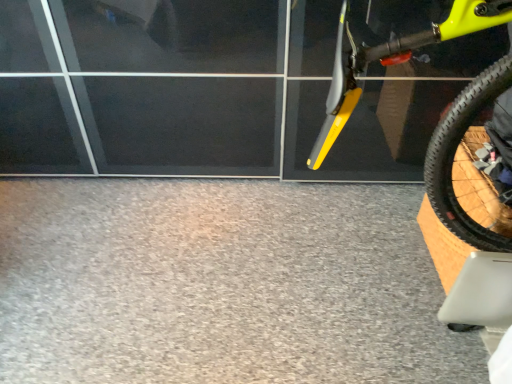
I want to click on yellow matte bicycle at right, so click(393, 59).

The image size is (512, 384). Describe the element at coordinates (393, 59) in the screenshot. I see `yellow matte bicycle at right` at that location.

What are the coordinates of `gray carpet at lower center` in the screenshot? It's located at (221, 285).

What do you see at coordinates (221, 285) in the screenshot? I see `gray carpet at lower center` at bounding box center [221, 285].

I want to click on yellow matte bicycle at right, so click(393, 59).

Considering the relative positions of yellow matte bicycle at right and gray carpet at lower center in the image provided, is yellow matte bicycle at right to the left or to the right of gray carpet at lower center?

yellow matte bicycle at right is positioned on gray carpet at lower center's right side.

Between yellow matte bicycle at right and gray carpet at lower center, which one is positioned behind?

gray carpet at lower center is further away from the camera.

Is point (311, 166) farther from viewer compared to point (98, 236)?

No, it is in front of (98, 236).

From the image's perspective, is yellow matte bicycle at right on gray carpet at lower center?

Correct, yellow matte bicycle at right appears higher than gray carpet at lower center in the image.

From a real-world perspective, is yellow matte bicycle at right positioned over gray carpet at lower center based on gravity?

Yes, from a real-world perspective, yellow matte bicycle at right is above gray carpet at lower center.

Does yellow matte bicycle at right have a greater width compared to gray carpet at lower center?

In fact, yellow matte bicycle at right might be narrower than gray carpet at lower center.

Can you confirm if yellow matte bicycle at right is taller than gray carpet at lower center?

Yes, yellow matte bicycle at right is taller than gray carpet at lower center.

Does yellow matte bicycle at right have a smaller size compared to gray carpet at lower center?

Incorrect, yellow matte bicycle at right is not smaller in size than gray carpet at lower center.

Would you say yellow matte bicycle at right is outside gray carpet at lower center?

Indeed, yellow matte bicycle at right is completely outside gray carpet at lower center.

Is yellow matte bicycle at right far from gray carpet at lower center?

yellow matte bicycle at right is near gray carpet at lower center, not far away.

Does yellow matte bicycle at right turn towards gray carpet at lower center?

No, yellow matte bicycle at right is not turned towards gray carpet at lower center.

Can you tell me how much yellow matte bicycle at right and gray carpet at lower center differ in facing direction?

1.89 degrees.

How far apart are yellow matte bicycle at right and gray carpet at lower center?

yellow matte bicycle at right and gray carpet at lower center are 87.08 centimeters apart.

The width and height of the screenshot is (512, 384). Identify the location of concrete beneath the yellow matte bicycle at right (from a real-world perspective). (221, 285).

Considering the relative positions of gray carpet at lower center and yellow matte bicycle at right in the image provided, is gray carpet at lower center to the left of yellow matte bicycle at right from the viewer's perspective?

Yes, gray carpet at lower center is to the left of yellow matte bicycle at right.

In the scene shown: Which object is closer to the camera taking this photo, gray carpet at lower center or yellow matte bicycle at right?

yellow matte bicycle at right is closer to the camera.

Does point (176, 306) lie in front of point (340, 121)?

That is False.

From the image's perspective, does gray carpet at lower center appear higher than yellow matte bicycle at right?

No.

From a real-world perspective, relative to yellow matte bicycle at right, is gray carpet at lower center vertically above or below?

gray carpet at lower center is below yellow matte bicycle at right.

Which of these two, gray carpet at lower center or yellow matte bicycle at right, is thinner?

Thinner between the two is yellow matte bicycle at right.

Is gray carpet at lower center shorter than yellow matte bicycle at right?

Correct, gray carpet at lower center is not as tall as yellow matte bicycle at right.

Looking at the image, does gray carpet at lower center seem bigger or smaller compared to yellow matte bicycle at right?

Clearly, gray carpet at lower center is smaller in size than yellow matte bicycle at right.

Is gray carpet at lower center spatially inside yellow matte bicycle at right, or outside of it?

gray carpet at lower center is not enclosed by yellow matte bicycle at right.

Are gray carpet at lower center and yellow matte bicycle at right far apart?

gray carpet at lower center is actually quite close to yellow matte bicycle at right.

Could you tell me if gray carpet at lower center is facing yellow matte bicycle at right?

No, gray carpet at lower center is not aimed at yellow matte bicycle at right.

Can you tell me how much gray carpet at lower center and yellow matte bicycle at right differ in facing direction?

The facing directions of gray carpet at lower center and yellow matte bicycle at right are 1.89 degrees apart.

The image size is (512, 384). In the image, there is a yellow matte bicycle at right. Identify the location of concrete below it (from a real-world perspective). (221, 285).

Where is `concrete below the yellow matte bicycle at right (from a real-world perspective)`? This screenshot has width=512, height=384. concrete below the yellow matte bicycle at right (from a real-world perspective) is located at coordinates (221, 285).

Locate an element on the screen. Image resolution: width=512 pixels, height=384 pixels. concrete on the left of the yellow matte bicycle at right is located at coordinates (221, 285).